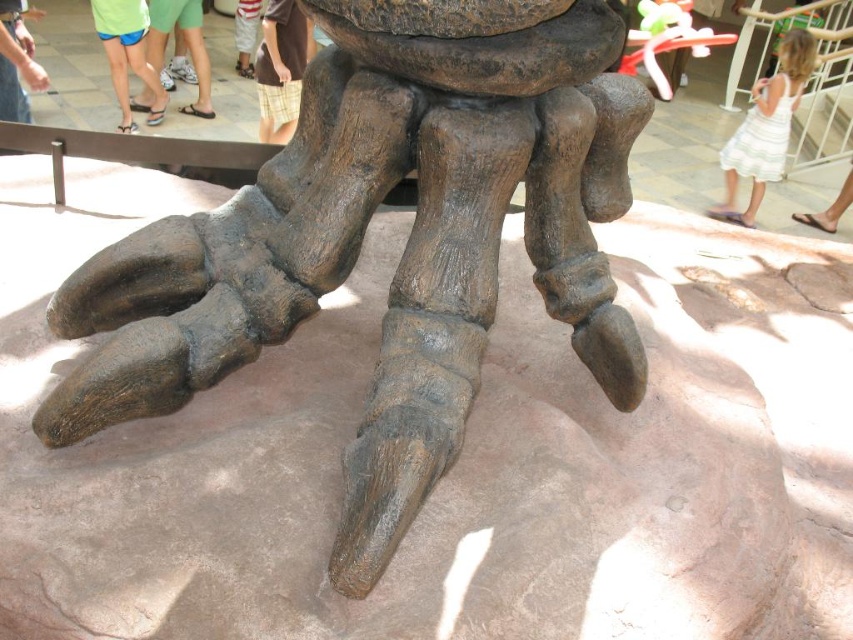
Is rough stone dinosaur foot at center shorter than brown leather sandals at lower right?

In fact, rough stone dinosaur foot at center may be taller than brown leather sandals at lower right.

Is point (451, 349) more distant than point (813, 221)?

No, it is in front of (813, 221).

Does point (467, 52) come closer to viewer compared to point (833, 225)?

Yes.

Image resolution: width=853 pixels, height=640 pixels. What are the coordinates of `rough stone dinosaur foot at center` in the screenshot? It's located at (363, 236).

Does rough stone dinosaur foot at center have a lesser width compared to green fabric shirt at upper left?

In fact, rough stone dinosaur foot at center might be wider than green fabric shirt at upper left.

Who is positioned more to the right, rough stone dinosaur foot at center or green fabric shirt at upper left?

Positioned to the right is rough stone dinosaur foot at center.

Is point (328, 275) less distant than point (38, 76)?

That is True.

Where is `rough stone dinosaur foot at center`? The image size is (853, 640). rough stone dinosaur foot at center is located at coordinates (x=363, y=236).

Between point (784, 51) and point (251, 20), which one is positioned behind?

Point (251, 20)

Can you confirm if white striped dress at upper right is taller than white striped shorts at lower center?

Yes, white striped dress at upper right is taller than white striped shorts at lower center.

Who is more distant from viewer, (730,138) or (247,35)?

The point (247,35) is more distant.

This screenshot has width=853, height=640. I want to click on white striped dress at upper right, so click(x=764, y=129).